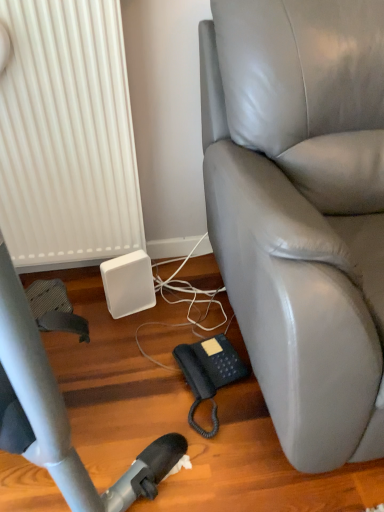
Find the location of a particular element. The image size is (384, 512). free space to the left of black rubberized phone at lower center is located at coordinates (137, 393).